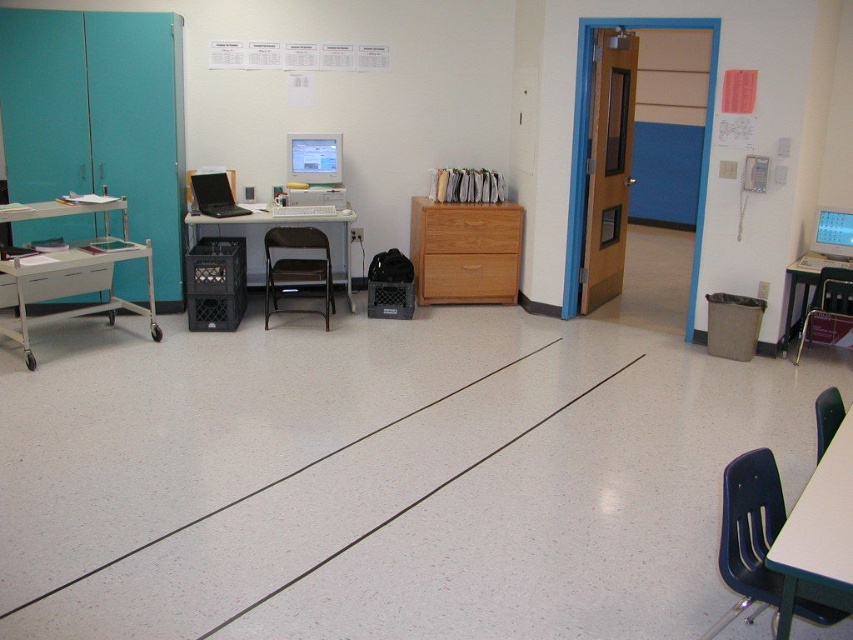
You are standing at the entrance of the room and want to sit down. There is a matte blue plastic chair at lower right. Can you reach it without moving any objects in the room?

Yes, the matte blue plastic chair at lower right is located at point (749, 536) which is within reach from the entrance without needing to move any objects.

You are organizing the office and need to place a new monitor on top of either the wooden file cabinet at center or the matte blue plastic chair at lower right. Based on their heights, which surface would be more stable for the monitor?

The wooden file cabinet at center has a greater height compared to the matte blue plastic chair at lower right, so placing the monitor on the wooden file cabinet at center would provide a more stable and level surface due to its height advantage.

You are organizing the office and need to move the wooden file cabinet at center and the matte blue plastic chair at lower right. Which object is closer to the teal colored cabinet with mirrored front located behind the rolling cart?

The wooden file cabinet at center is closer to the teal colored cabinet with mirrored front located behind the rolling cart because it is positioned on the left side of the matte blue plastic chair at lower right, which places it nearer to the teal cabinet.